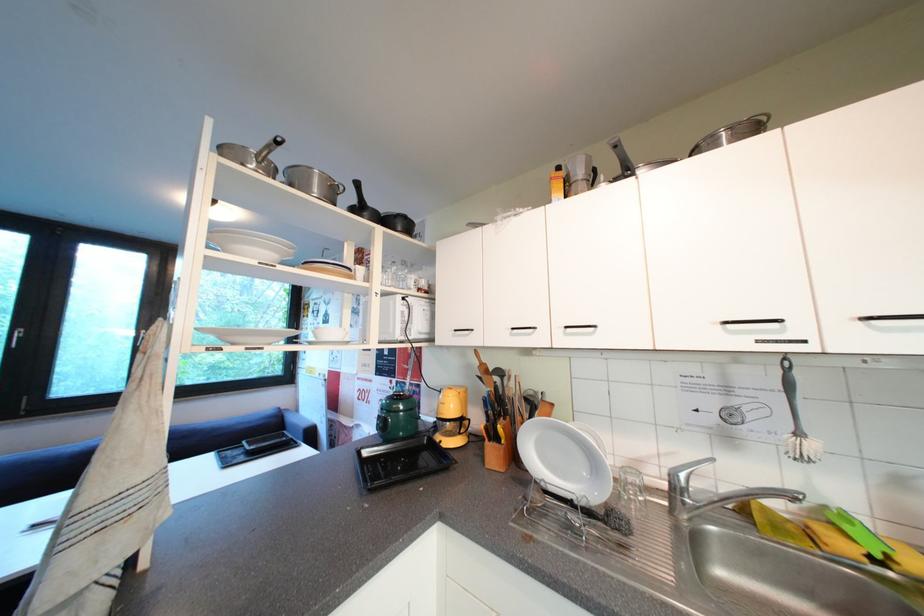
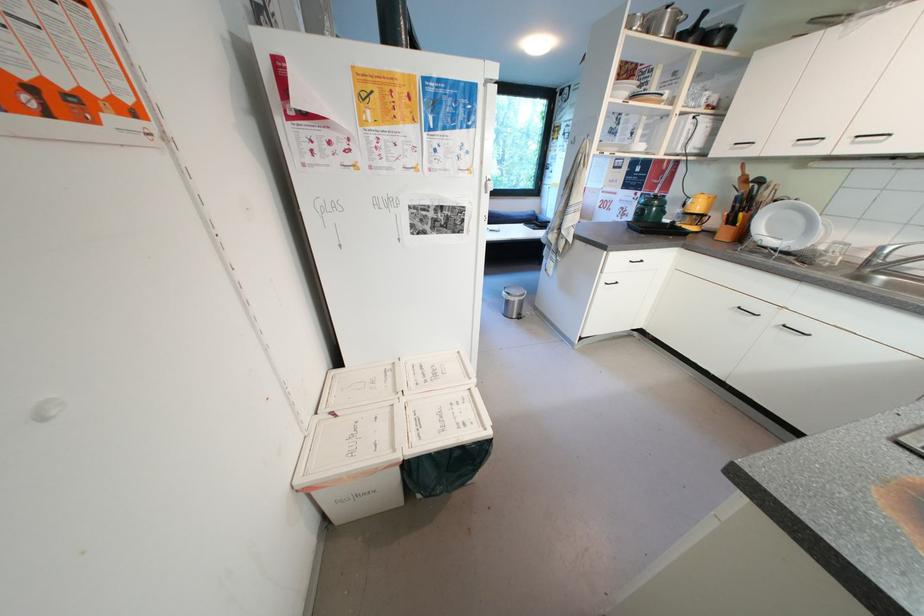
Find the pixel in the second image that matches the point at 524,459 in the first image.

(749, 238)